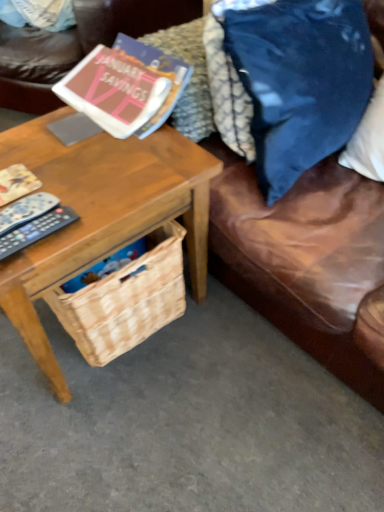
In order to click on vacant point above woodenobject at left (from a real-world perspective) in this screenshot , I will do `click(77, 158)`.